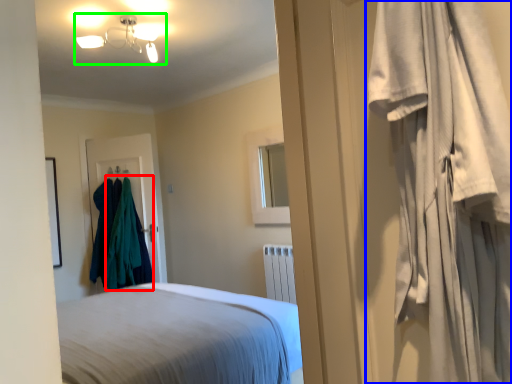
Question: Considering the real-world distances, which object is farthest from clothing (highlighted by a red box)? curtain (highlighted by a blue box) or lamp (highlighted by a green box)?

Choices:
 (A) curtain
 (B) lamp

Answer: (A)